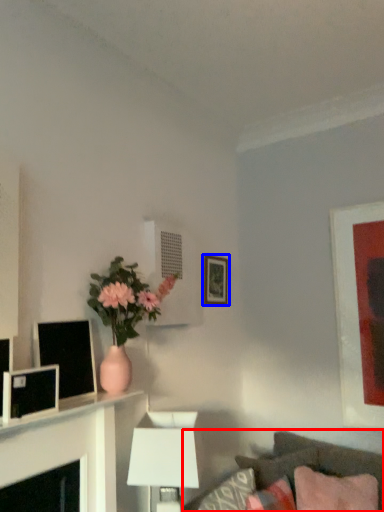
Question: Among these objects, which one is nearest to the camera, studio couch (highlighted by a red box) or picture frame (highlighted by a blue box)?

Choices:
 (A) studio couch
 (B) picture frame

Answer: (A)